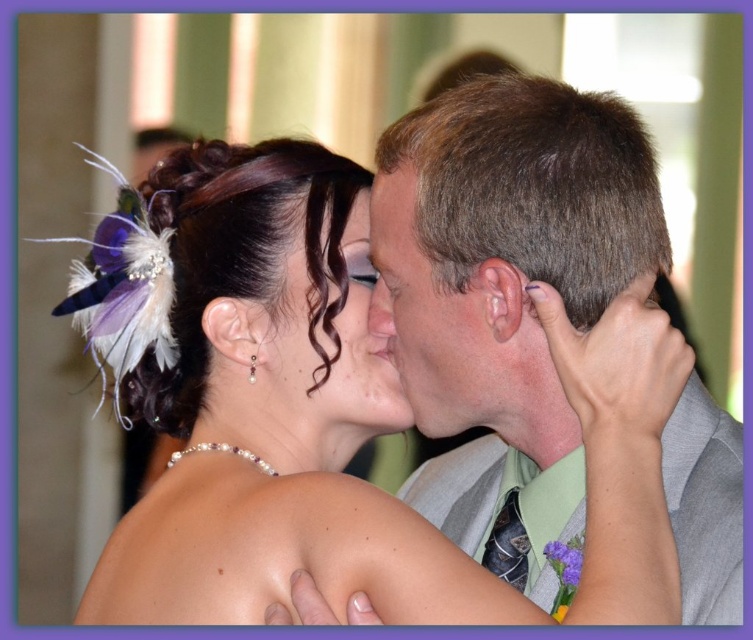
Question: Which object is farther from the camera taking this photo?

Choices:
 (A) matte gray suit at center
 (B) smooth skin nose at center

Answer: (B)

Question: Which is farther from the matte black hair at center?

Choices:
 (A) gray fabric suit at center
 (B) matte gray suit at center
 (C) pearl necklace at center
 (D) smooth skin nose at center

Answer: (A)

Question: Can you confirm if gray fabric suit at center is smaller than smooth skin nose at center?

Choices:
 (A) no
 (B) yes

Answer: (A)

Question: Can you confirm if pearl necklace at center is smaller than matte gray suit at center?

Choices:
 (A) yes
 (B) no

Answer: (B)

Question: Which point is farther to the camera?

Choices:
 (A) (376, 307)
 (B) (355, 189)

Answer: (B)

Question: Can you confirm if matte gray suit at center is positioned above smooth skin nose at center?

Choices:
 (A) no
 (B) yes

Answer: (A)